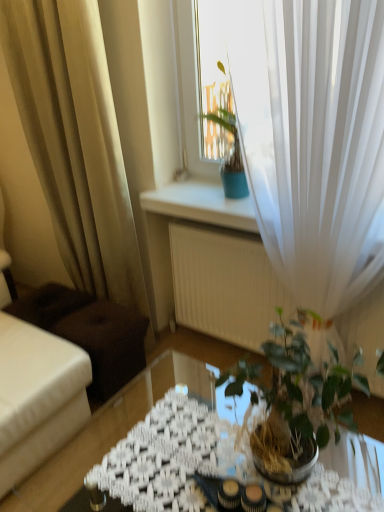
The width and height of the screenshot is (384, 512). Identify the location of vacant region above translucent glass table at center (from a real-world perspective). (175, 454).